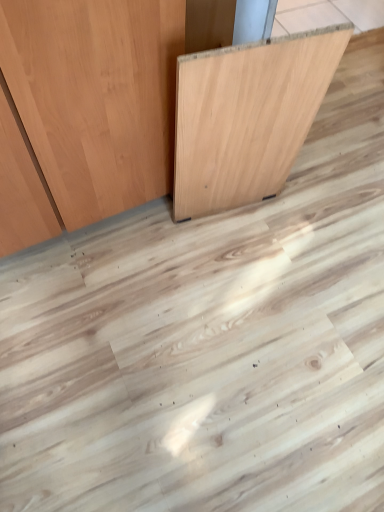
What do you see at coordinates (249, 113) in the screenshot? I see `natural wood board at center` at bounding box center [249, 113].

The width and height of the screenshot is (384, 512). I want to click on natural wood board at center, so click(x=249, y=113).

Find the location of a particular element. natural wood board at center is located at coordinates (249, 113).